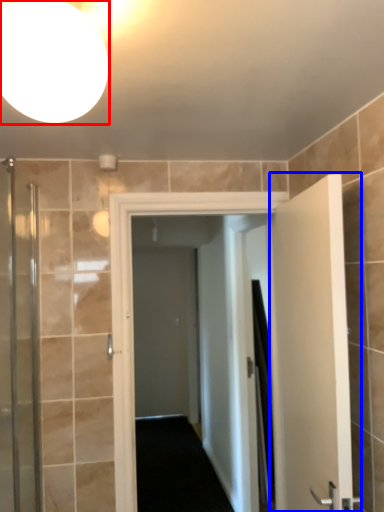
Question: Which of the following is the closest to the observer, light fixture (highlighted by a red box) or door (highlighted by a blue box)?

Choices:
 (A) light fixture
 (B) door

Answer: (A)